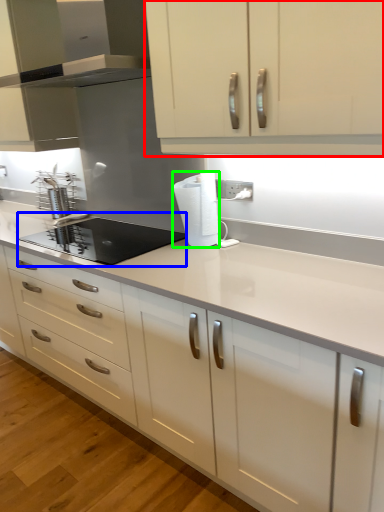
Question: Estimate the real-world distances between objects in this image. Which object is closer to cabinetry (highlighted by a red box), kitchen appliance (highlighted by a blue box) or paper towel (highlighted by a green box)?

Choices:
 (A) kitchen appliance
 (B) paper towel

Answer: (B)